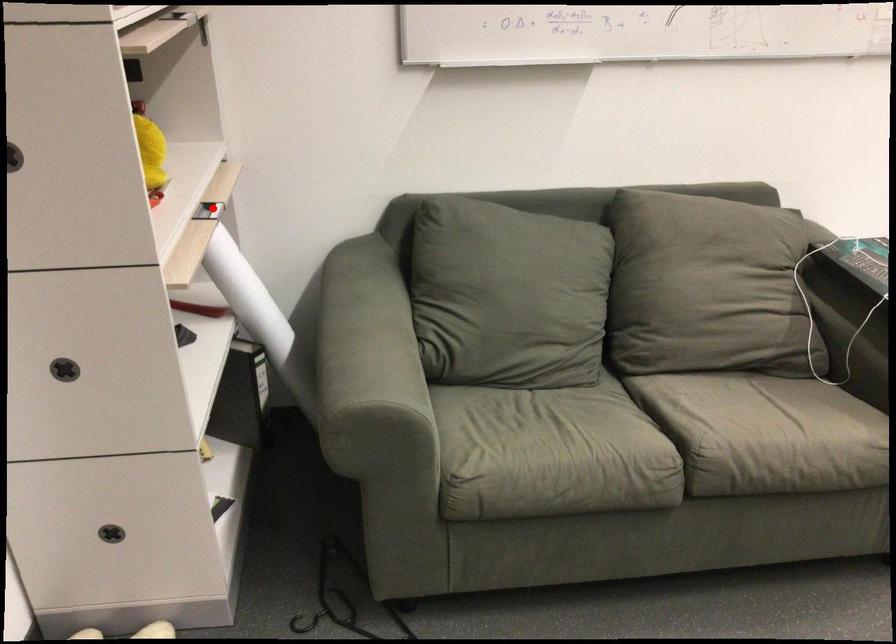
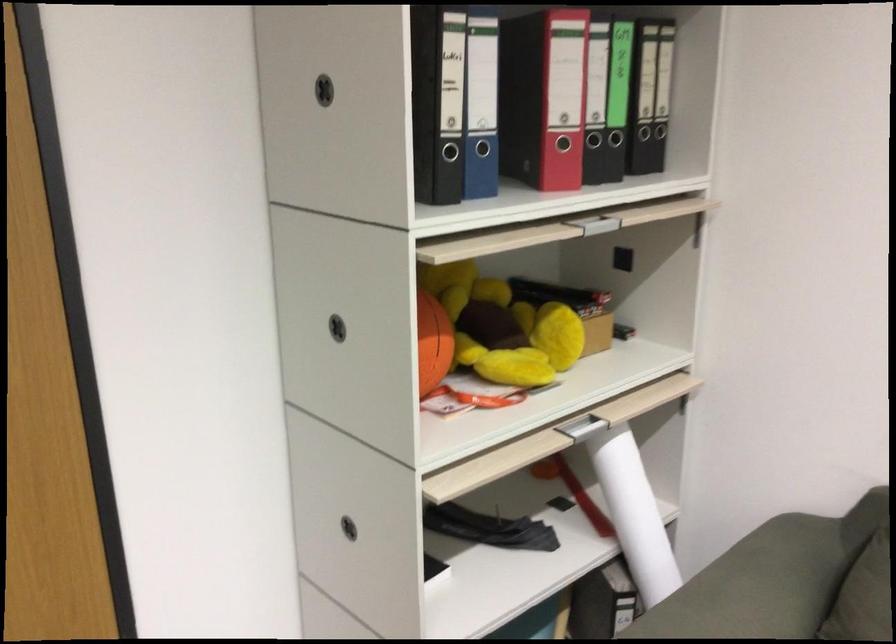
Question: A red point is marked in image1. In image2, is the corresponding 3D point closer to the camera or farther? Reply with the corresponding letter.

Choices:
 (A) The corresponding 3D point is closer.
 (B) The corresponding 3D point is farther.

Answer: (A)